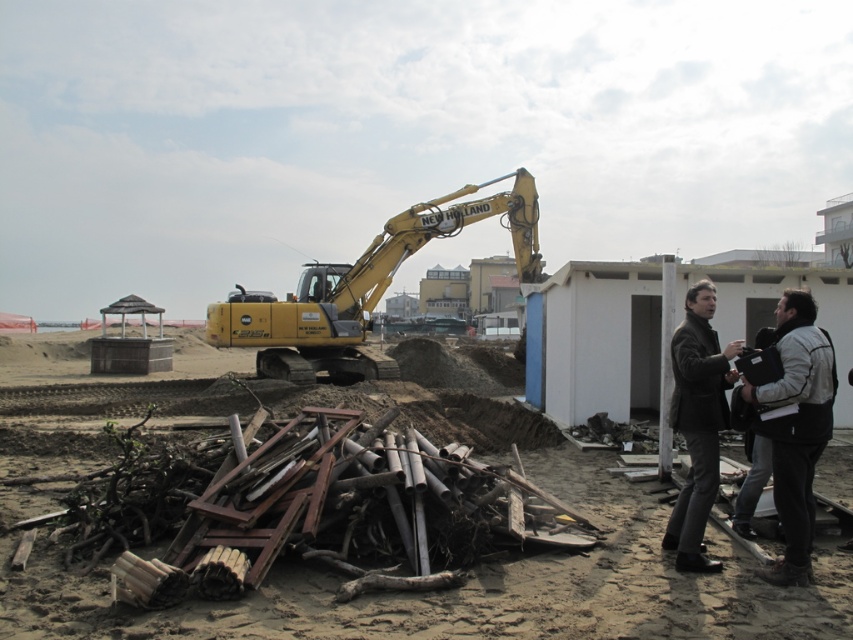
Question: Does dark gray jacket at lower right appear on the right side of dark brown leather jacket at lower right?

Choices:
 (A) yes
 (B) no

Answer: (A)

Question: Is dark gray jacket at lower right positioned before dark brown leather jacket at lower right?

Choices:
 (A) yes
 (B) no

Answer: (A)

Question: Can you confirm if yellow metallic excavator at center is smaller than dark gray jacket at lower right?

Choices:
 (A) yes
 (B) no

Answer: (B)

Question: Which is nearer to the yellow metallic excavator at center?

Choices:
 (A) dark brown leather jacket at lower right
 (B) brown sandy dirt at center
 (C) dark gray jacket at lower right

Answer: (B)

Question: Which is farther from the yellow metallic excavator at center?

Choices:
 (A) dark gray jacket at lower right
 (B) dark brown leather jacket at lower right

Answer: (A)

Question: Which object is positioned closest to the yellow metallic excavator at center?

Choices:
 (A) dark gray jacket at lower right
 (B) brown sandy dirt at center
 (C) dark brown leather jacket at lower right

Answer: (B)